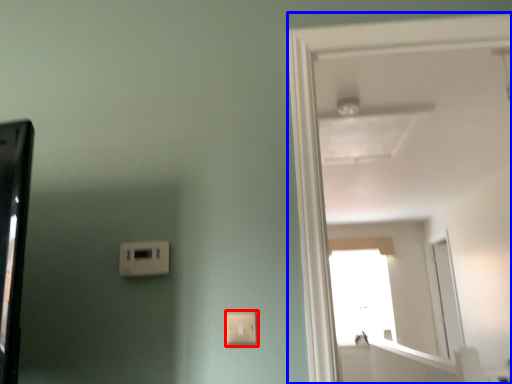
Question: Among these objects, which one is nearest to the camera, light switch (highlighted by a red box) or door (highlighted by a blue box)?

Choices:
 (A) light switch
 (B) door

Answer: (B)